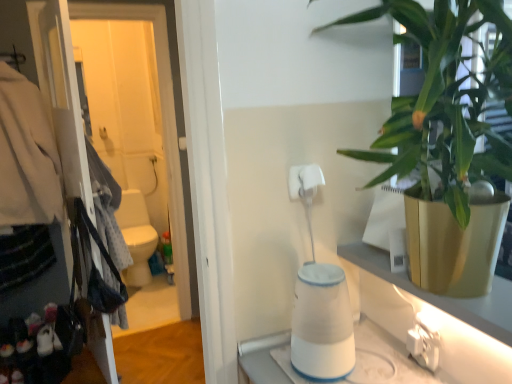
Question: Is white glossy screen door at left to the right of white glossy toilet at center from the viewer's perspective?

Choices:
 (A) no
 (B) yes

Answer: (B)

Question: Is white glossy screen door at left in front of white glossy toilet at center?

Choices:
 (A) no
 (B) yes

Answer: (B)

Question: Is white glossy screen door at left outside white glossy toilet at center?

Choices:
 (A) yes
 (B) no

Answer: (A)

Question: Considering the relative sizes of white glossy screen door at left and white glossy toilet at center in the image provided, is white glossy screen door at left wider than white glossy toilet at center?

Choices:
 (A) yes
 (B) no

Answer: (B)

Question: From the image's perspective, is white glossy screen door at left beneath white glossy toilet at center?

Choices:
 (A) yes
 (B) no

Answer: (B)

Question: Can you confirm if white glossy screen door at left is positioned to the left of white glossy toilet at center?

Choices:
 (A) no
 (B) yes

Answer: (A)

Question: Is white glossy toilet at center surrounding white plastic electric outlet at lower right?

Choices:
 (A) no
 (B) yes

Answer: (A)

Question: Can you confirm if white glossy toilet at center is shorter than white plastic electric outlet at lower right?

Choices:
 (A) no
 (B) yes

Answer: (A)

Question: Is white plastic electric outlet at lower right at the back of white glossy toilet at center?

Choices:
 (A) no
 (B) yes

Answer: (A)

Question: Considering the relative sizes of white glossy toilet at center and white plastic electric outlet at lower right in the image provided, is white glossy toilet at center wider than white plastic electric outlet at lower right?

Choices:
 (A) no
 (B) yes

Answer: (B)

Question: From the image's perspective, is white glossy toilet at center beneath white plastic electric outlet at lower right?

Choices:
 (A) no
 (B) yes

Answer: (A)

Question: Is white glossy toilet at center taller than white plastic electric outlet at lower right?

Choices:
 (A) no
 (B) yes

Answer: (B)

Question: Is green leafy plant at upper right oriented away from matte black coat hanger at left?

Choices:
 (A) no
 (B) yes

Answer: (A)